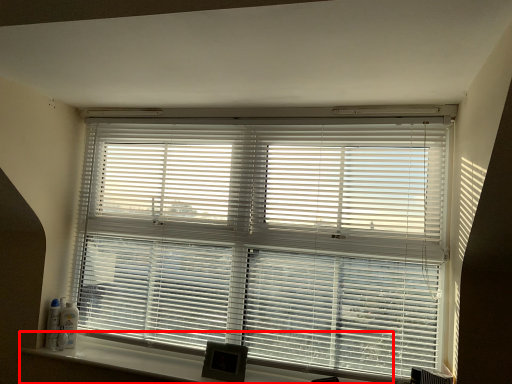
Question: From the image's perspective, considering the relative positions of window sill (annotated by the red box) and window blind in the image provided, where is window sill (annotated by the red box) located with respect to the staircase?

Choices:
 (A) above
 (B) below

Answer: (B)